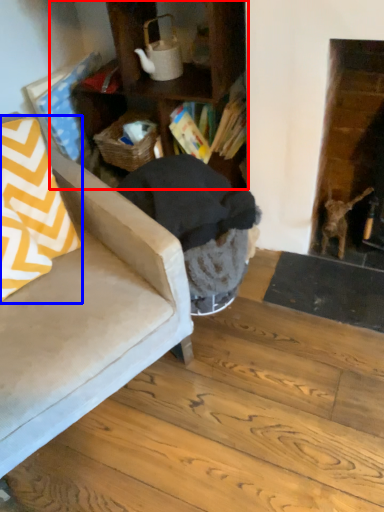
Question: Which object is closer to the camera taking this photo, cabinetry (highlighted by a red box) or throw pillow (highlighted by a blue box)?

Choices:
 (A) cabinetry
 (B) throw pillow

Answer: (B)